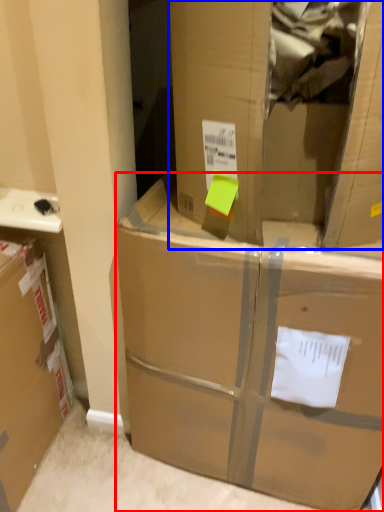
Question: Which point is closer to the camera, box (highlighted by a red box) or cardboard box (highlighted by a blue box)?

Choices:
 (A) box
 (B) cardboard box

Answer: (B)